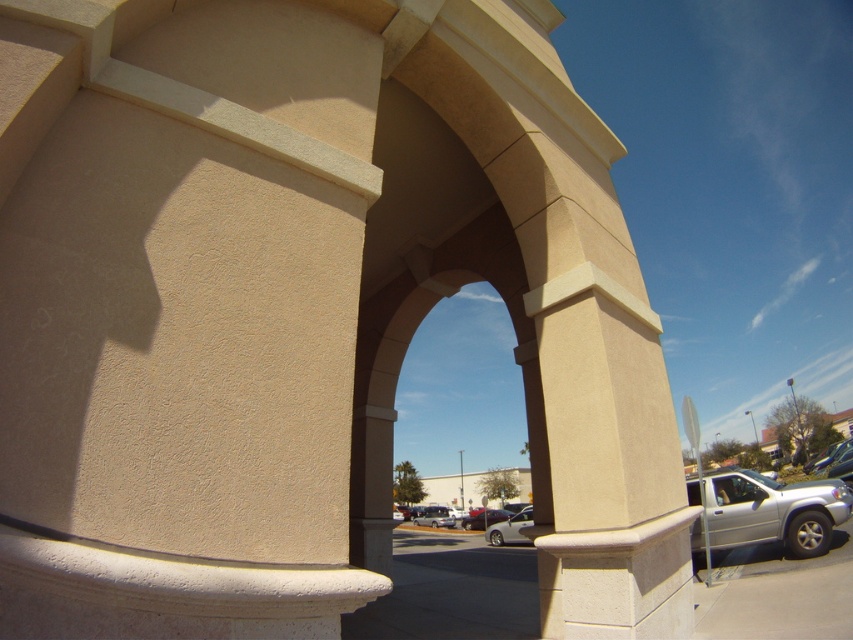
You are standing in front of the beige stone archway and want to park your car in the parking lot visible through the arch. The parking spot you want is at coordinates point 0.827, 0.599. Is the silver metallic car at center currently blocking your desired parking spot?

The silver metallic car at center is positioned at point (509, 529), so it is blocking your desired parking spot.

You are a delivery person who needs to park your 5.5 meter long truck between the metallic silver car at right and the silver metallic bus at center. Is there enough space for your truck?

The distance between the metallic silver car at right and the silver metallic bus at center is 13.23 meters. Since your truck is only 5.5 meters long, there is ample space to park it between them.